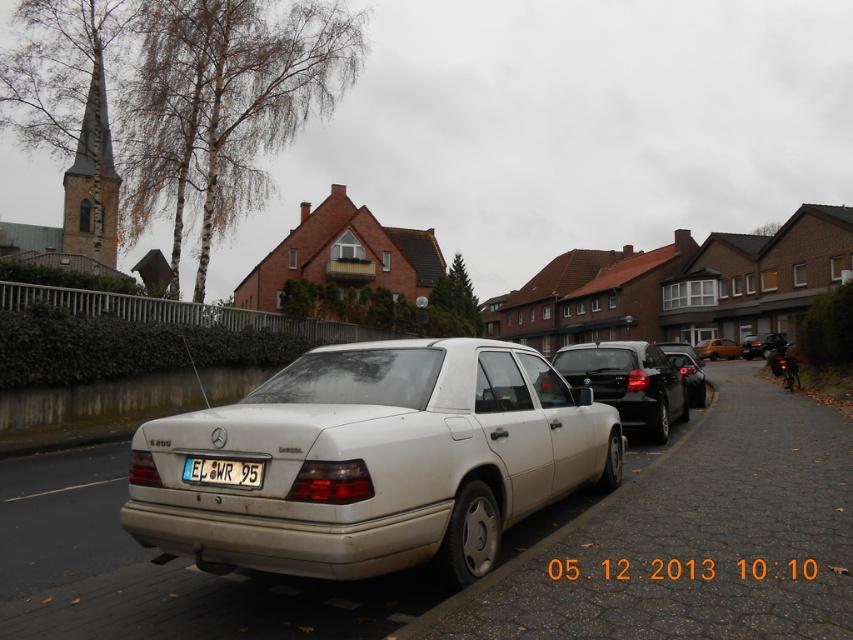
Consider the image. You are standing on the residential street and want to take a photo of both point [204,464] and point [734,342]. Which point will appear larger in your camera view?

Point [204,464] will appear larger in your camera view because it is closer to the camera than point [734,342].

You are a delivery driver who needs to park your vehicle on the street. The silver metallic sedan at center is blocking the parking spot you want to use. Can you drive around it to access the parking spot behind the white concrete curb at lower center?

The silver metallic sedan at center is above the white concrete curb at lower center, meaning it is parked on top of the curb. This position would block access to the parking spot behind the curb, so you cannot drive around it to reach the desired spot.